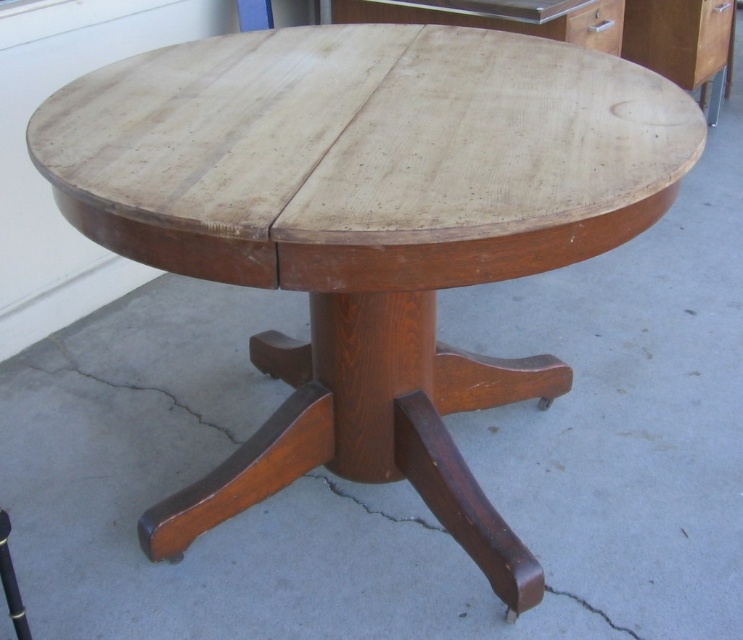
Is glossy wood drawer at upper right thinner than matte wood drawer at upper right?

Incorrect, glossy wood drawer at upper right's width is not less than matte wood drawer at upper right's.

Who is higher up, glossy wood drawer at upper right or matte wood drawer at upper right?

glossy wood drawer at upper right is higher up.

From the picture: Who is more forward, (730, 17) or (606, 19)?

Positioned in front is point (606, 19).

The width and height of the screenshot is (743, 640). I want to click on glossy wood drawer at upper right, so click(713, 36).